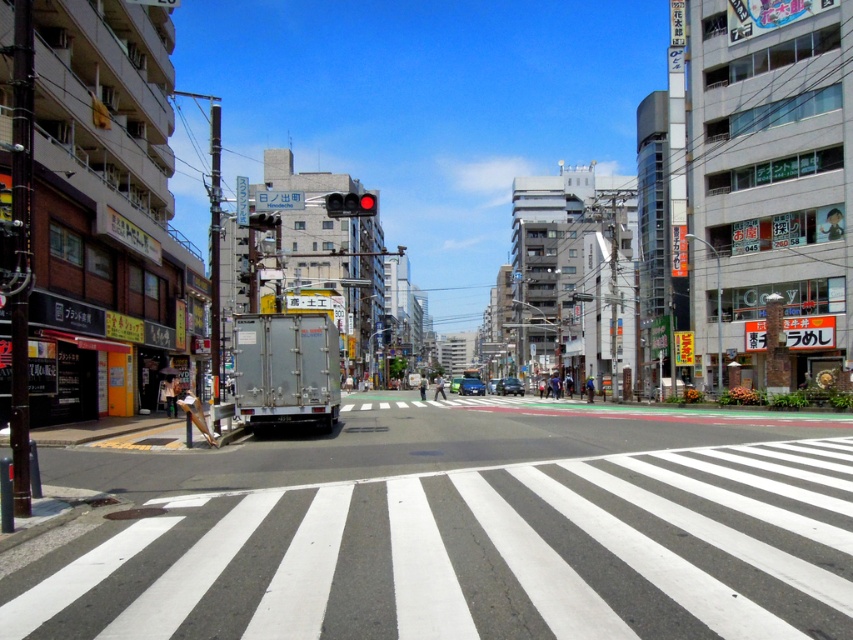
Question: Estimate the real-world distances between objects in this image. Which object is closer to the white asphalt crosswalk at center?

Choices:
 (A) red glass traffic light at center
 (B) metallic silver van at center
 (C) red glass traffic light at upper center

Answer: (A)

Question: Among these points, which one is farthest from the camera?

Choices:
 (A) (369, 205)
 (B) (451, 385)
 (C) (252, 228)

Answer: (B)

Question: Where is blue metallic car at center located in relation to metallic silver van at center in the image?

Choices:
 (A) right
 (B) left

Answer: (A)

Question: Is white asphalt crosswalk at center to the left of red glass traffic light at center from the viewer's perspective?

Choices:
 (A) no
 (B) yes

Answer: (A)

Question: Estimate the real-world distances between objects in this image. Which object is farther from the blue metallic car at center?

Choices:
 (A) matte black car at center
 (B) red glass traffic light at upper center
 (C) metallic silver van at center
 (D) red glass traffic light at center

Answer: (B)

Question: Observing the image, what is the correct spatial positioning of red glass traffic light at upper center in reference to metallic silver van at center?

Choices:
 (A) left
 (B) right

Answer: (A)